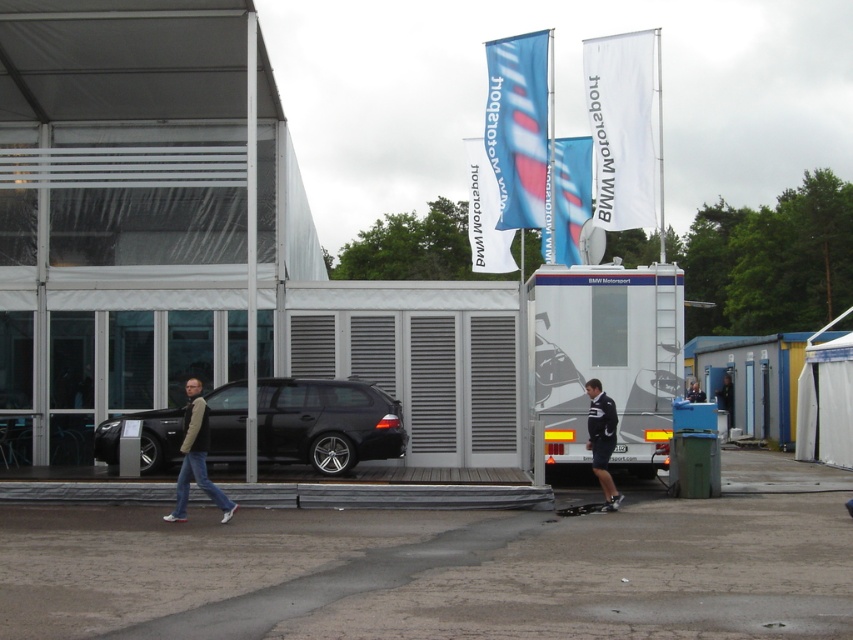
Can you confirm if dark gray jeans at lower left is positioned below black rubber skateboard at lower center?

Incorrect, dark gray jeans at lower left is not positioned below black rubber skateboard at lower center.

Identify the location of dark gray jeans at lower left. (196, 456).

Does dark blue uniform at center have a lesser height compared to black rubber skateboard at lower center?

No, dark blue uniform at center is not shorter than black rubber skateboard at lower center.

Does dark blue uniform at center have a lesser width compared to black rubber skateboard at lower center?

Indeed, dark blue uniform at center has a lesser width compared to black rubber skateboard at lower center.

This screenshot has width=853, height=640. I want to click on dark blue uniform at center, so click(x=602, y=440).

Is point (302, 444) farther from viewer compared to point (555, 513)?

Yes.

Who is more distant from viewer, (271, 400) or (569, 506)?

The point (271, 400) is behind.

You are a GUI agent. You are given a task and a screenshot of the screen. Output one action in this format:
    pyautogui.click(x=<x>, y=<y>)
    Task: Click on the shiny black car at center
    
    Given the screenshot: What is the action you would take?
    pyautogui.click(x=328, y=422)